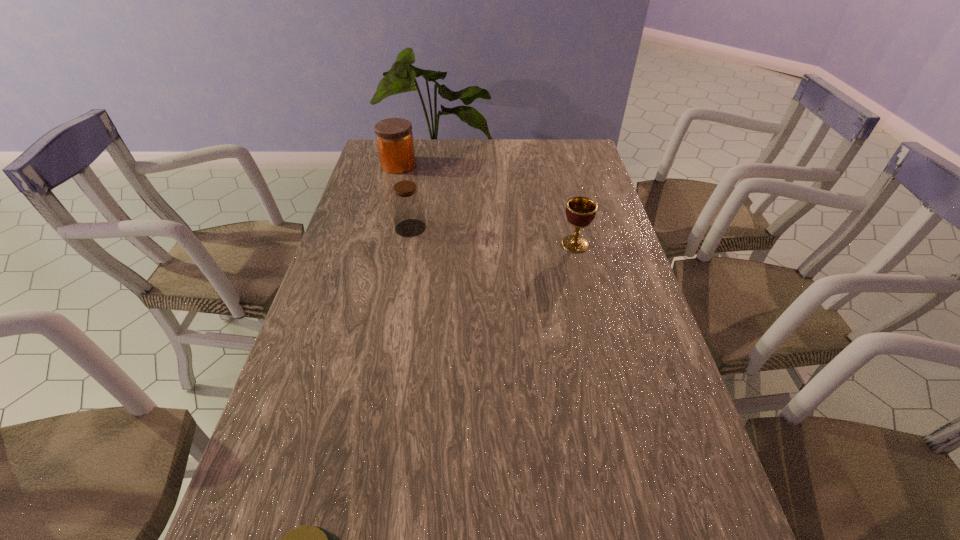
At what (x,y) coordinates should I click in order to perform the action: click on the farthest object. Please return your answer as a coordinate pair (x, y). Image resolution: width=960 pixels, height=540 pixels. Looking at the image, I should click on (394, 136).

At what (x,y) coordinates should I click in order to perform the action: click on the second farthest jar. Please return your answer as a coordinate pair (x, y). Looking at the image, I should click on (407, 205).

The image size is (960, 540). Find the location of `chalice`. chalice is located at coordinates (580, 211).

Identify the location of vacant space located 0.060m on the right of the farthest object. (432, 165).

The image size is (960, 540). What are the coordinates of `vacant region located on the back of the second farthest jar` in the screenshot? It's located at (420, 172).

Locate an element on the screen. Image resolution: width=960 pixels, height=540 pixels. vacant area situated on the left of the chalice is located at coordinates (538, 244).

The image size is (960, 540). Identify the location of object that is at the far edge. (394, 136).

This screenshot has width=960, height=540. I want to click on object present at the left edge, so click(394, 136).

Find the location of a particular element. The width and height of the screenshot is (960, 540). object that is at the right edge is located at coordinates (580, 211).

This screenshot has width=960, height=540. Identify the location of object at the far left corner. 394,136.